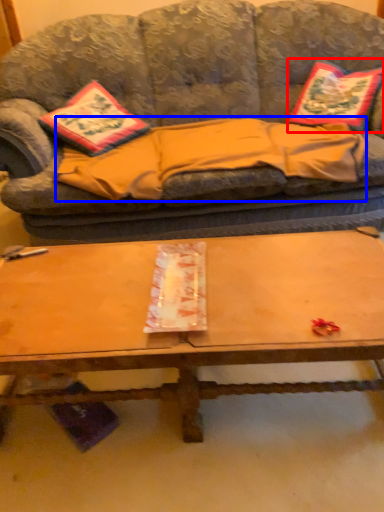
Question: Which of the following is the closest to the observer, pillow (highlighted by a red box) or blanket (highlighted by a blue box)?

Choices:
 (A) pillow
 (B) blanket

Answer: (B)